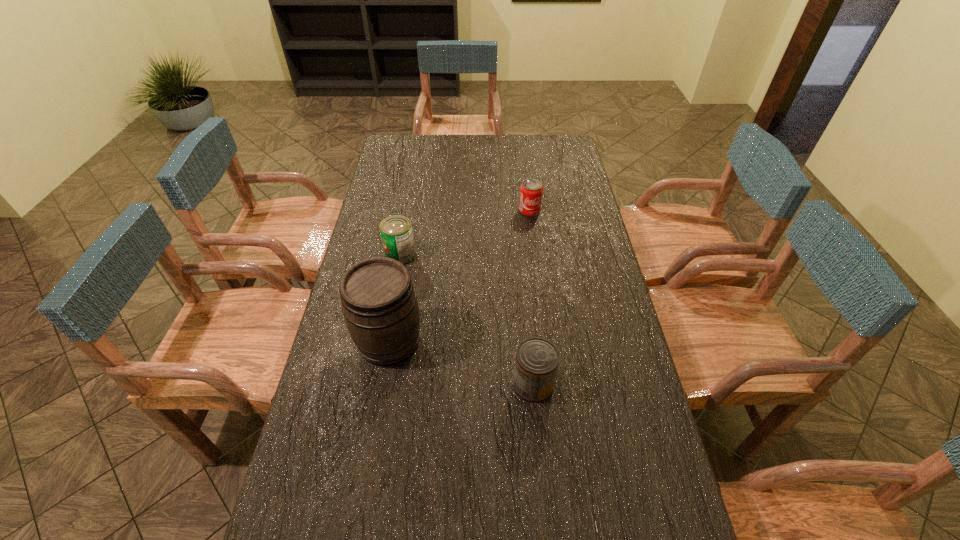
What are the coordinates of `object that can be found as the closest to the leftmost can` in the screenshot? It's located at (379, 303).

Select which can is the closest to the farthest object. Please provide its 2D coordinates. Your answer should be formatted as a tuple, i.e. [(x, y)], where the tuple contains the x and y coordinates of a point satisfying the conditions above.

[(396, 231)]

The height and width of the screenshot is (540, 960). What are the coordinates of `can that is the second nearest to the second nearest can` in the screenshot? It's located at (536, 362).